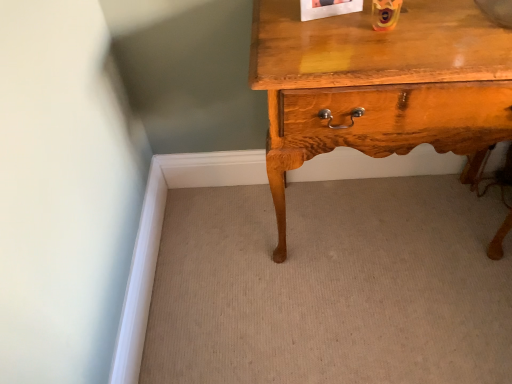
The height and width of the screenshot is (384, 512). What do you see at coordinates (379, 85) in the screenshot?
I see `glossy wood nightstand at right` at bounding box center [379, 85].

Locate an element on the screen. glossy wood nightstand at right is located at coordinates (379, 85).

This screenshot has height=384, width=512. What are the coordinates of `glossy wood nightstand at right` in the screenshot? It's located at (379, 85).